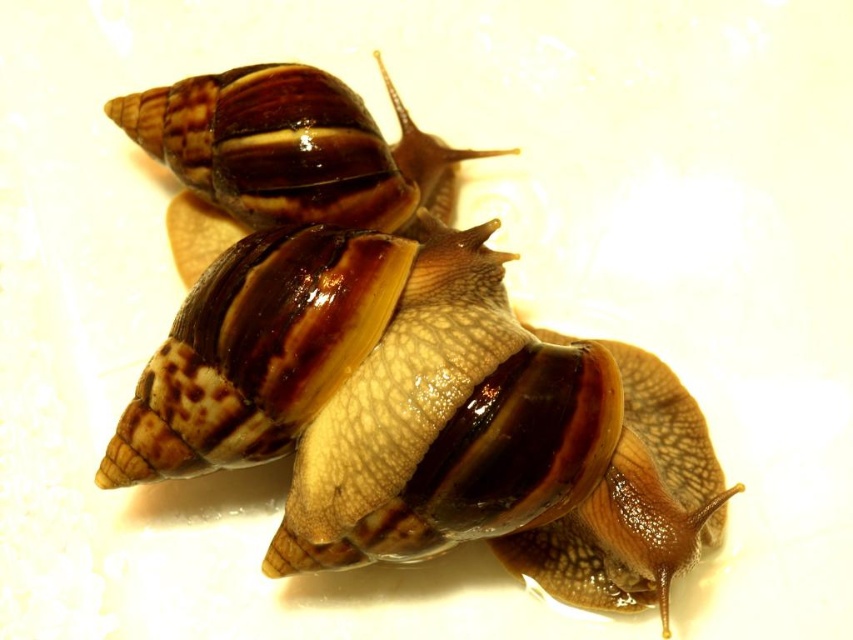
Which is more to the left, brown shiny shell at center or shiny brown shell at upper center?

From the viewer's perspective, shiny brown shell at upper center appears more on the left side.

Find the location of `brown shiny shell at center`. brown shiny shell at center is located at coordinates (393, 358).